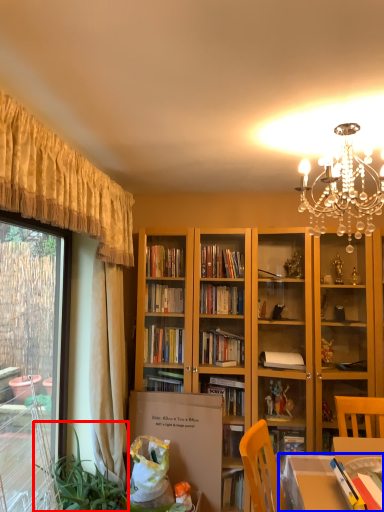
Question: Which point is closer to the camera, plant (highlighted by a red box) or table (highlighted by a blue box)?

Choices:
 (A) plant
 (B) table

Answer: (B)